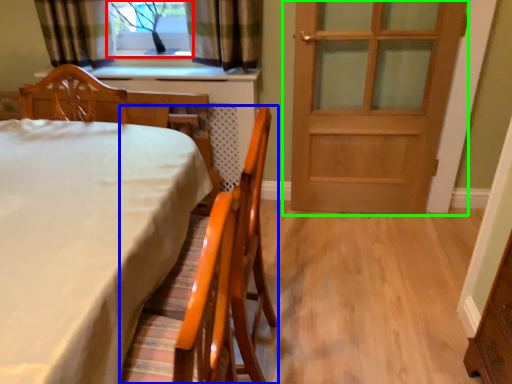
Question: Considering the real-world distances, which object is farthest from window (highlighted by a red box)? chair (highlighted by a blue box) or door (highlighted by a green box)?

Choices:
 (A) chair
 (B) door

Answer: (A)